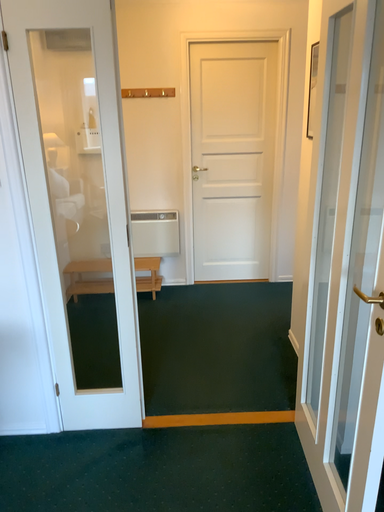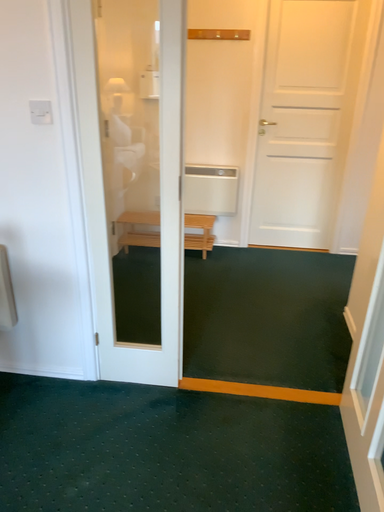
Question: How did the camera likely rotate when shooting the video?

Choices:
 (A) rotated right
 (B) rotated left

Answer: (B)